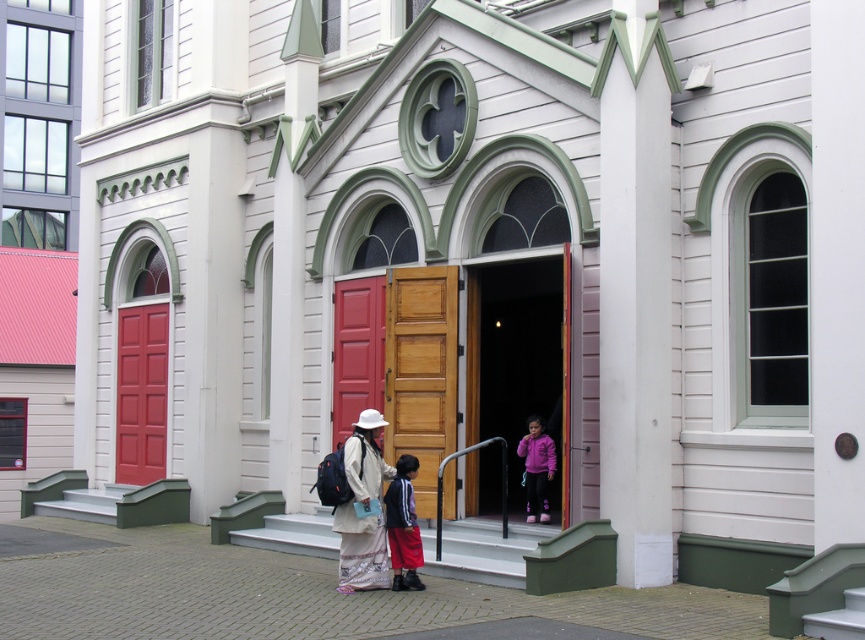
Question: Among these objects, which one is farthest from the camera?

Choices:
 (A) matte red door at center
 (B) matte red door at left
 (C) wooden door at center

Answer: (B)

Question: Which of the following is the farthest from the observer?

Choices:
 (A) striped fabric jacket at center
 (B) smooth concrete stairs at center
 (C) pink matte jacket at center

Answer: (C)

Question: Which is nearer to the wooden door at center?

Choices:
 (A) matte red door at left
 (B) matte red door at center
 (C) striped fabric jacket at center

Answer: (B)

Question: Can you confirm if matte red door at left is thinner than pink matte jacket at center?

Choices:
 (A) no
 (B) yes

Answer: (A)

Question: Is smooth concrete stairs at center below matte red door at center?

Choices:
 (A) yes
 (B) no

Answer: (A)

Question: Does smooth concrete stairs at center appear over matte red door at left?

Choices:
 (A) no
 (B) yes

Answer: (A)